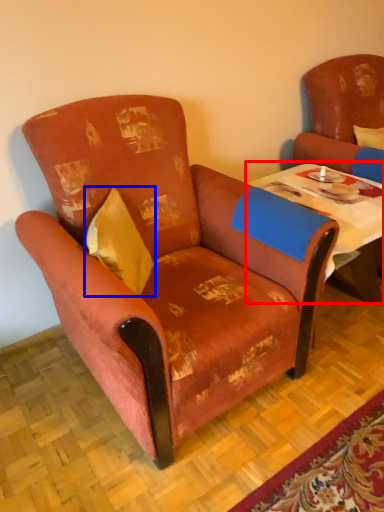
Question: Which point is further to the camera, table (highlighted by a red box) or pillow (highlighted by a blue box)?

Choices:
 (A) table
 (B) pillow

Answer: (A)